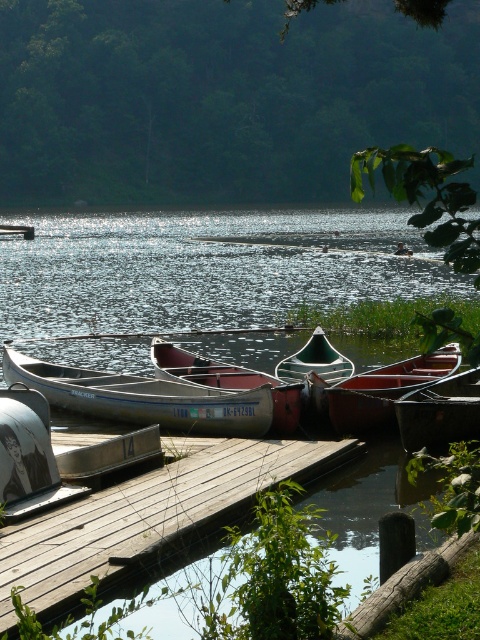
Between glistening water at center and white plastic canoe at center, which one appears on the right side from the viewer's perspective?

From the viewer's perspective, white plastic canoe at center appears more on the right side.

Can you confirm if glistening water at center is wider than white plastic canoe at center?

Indeed, glistening water at center has a greater width compared to white plastic canoe at center.

Measure the distance between glistening water at center and camera.

The distance of glistening water at center from camera is 18.67 meters.

The height and width of the screenshot is (640, 480). Identify the location of glistening water at center. (206, 268).

Which is above, wooden dock at center or rusty metal canoe at center?

rusty metal canoe at center

Measure the distance between wooden dock at center and camera.

wooden dock at center and camera are 21.07 feet apart from each other.

The height and width of the screenshot is (640, 480). What are the coordinates of `wooden dock at center` in the screenshot? It's located at (148, 520).

Who is positioned more to the left, glistening water at center or wooden dock at center?

From the viewer's perspective, glistening water at center appears more on the left side.

Between glistening water at center and wooden dock at center, which one has more height?

Standing taller between the two is glistening water at center.

Between point (387, 228) and point (70, 552), which one is positioned behind?

Point (387, 228)

Find the location of `glistening water at center`. glistening water at center is located at coordinates click(x=206, y=268).